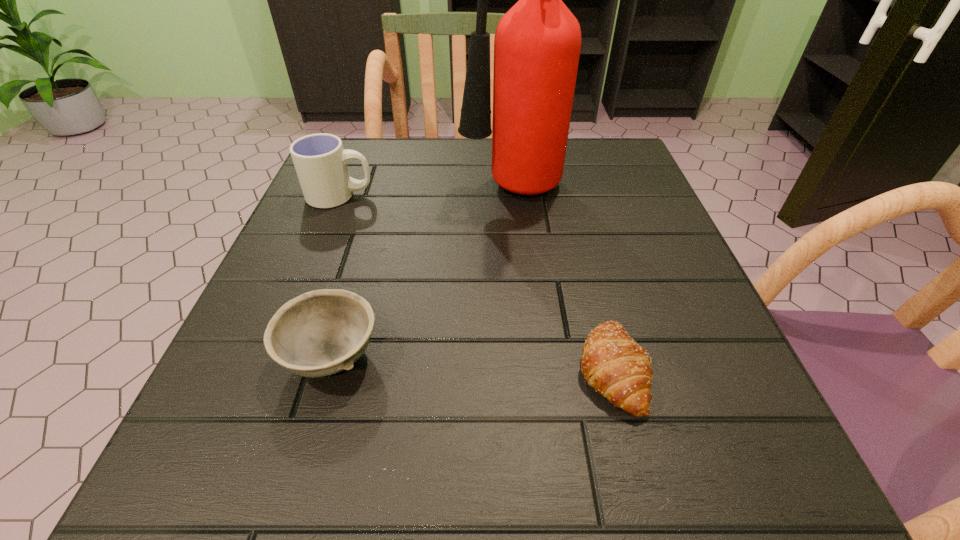
Where is `vacant space that satisfies the following two spatial constraints: 1. with the handle on the side of the third shortest object; 2. on the back side of the crescent roll`? Image resolution: width=960 pixels, height=540 pixels. vacant space that satisfies the following two spatial constraints: 1. with the handle on the side of the third shortest object; 2. on the back side of the crescent roll is located at coordinates (270, 369).

Where is `vacant space that satisfies the following two spatial constraints: 1. at the nozzle of the crescent roll; 2. on the right side of the tallest object`? This screenshot has width=960, height=540. vacant space that satisfies the following two spatial constraints: 1. at the nozzle of the crescent roll; 2. on the right side of the tallest object is located at coordinates (527, 369).

In order to click on free space that satisfies the following two spatial constraints: 1. at the nozzle of the shortest object; 2. on the left side of the tallest object in this screenshot , I will do `click(527, 369)`.